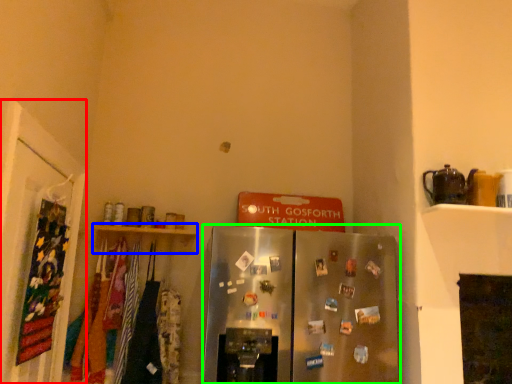
Question: Based on their relative distances, which object is farther from door (highlighted by a red box)? Choose from shelf (highlighted by a blue box) and refrigerator (highlighted by a green box).

Choices:
 (A) shelf
 (B) refrigerator

Answer: (B)